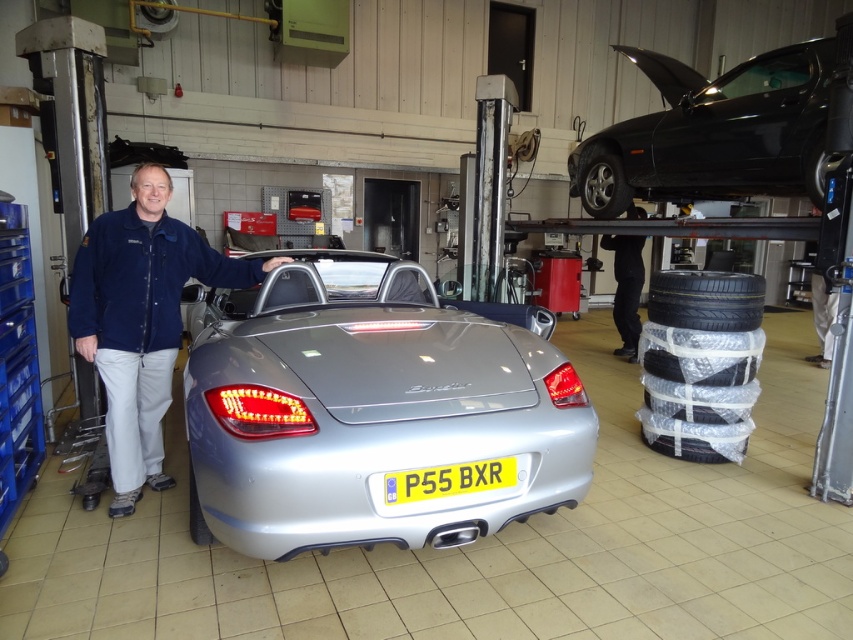
Question: Which point appears farthest from the camera in this image?

Choices:
 (A) (527, 445)
 (B) (437, 490)

Answer: (A)

Question: Which of the following is the closest to the observer?

Choices:
 (A) (219, 323)
 (B) (686, 198)
 (C) (747, 312)

Answer: (A)

Question: In this image, where is satin silver car at center located relative to black rubber tire at upper right?

Choices:
 (A) left
 (B) right

Answer: (A)

Question: Where is blue denim jacket at center located in relation to yellow plastic license plate at center in the image?

Choices:
 (A) left
 (B) right

Answer: (A)

Question: Can you confirm if black rubber tire at right is wider than silver metallic tire at lower left?

Choices:
 (A) yes
 (B) no

Answer: (A)

Question: Among these objects, which one is farthest from the camera?

Choices:
 (A) yellow plastic license plate at center
 (B) silver metallic tire at lower left

Answer: (B)